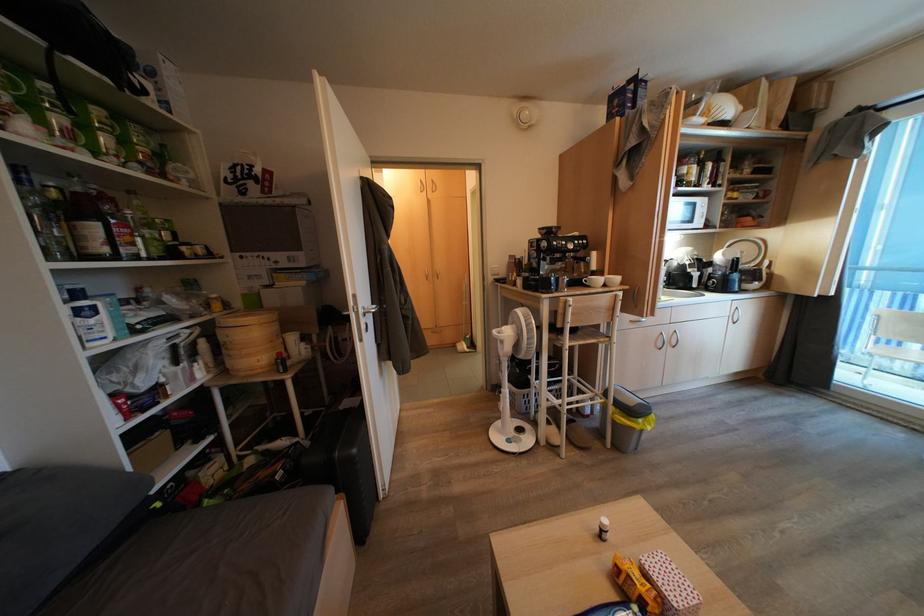
Image resolution: width=924 pixels, height=616 pixels. What are the coordinates of `glass liquor bottle` in the screenshot? It's located at (89, 225).